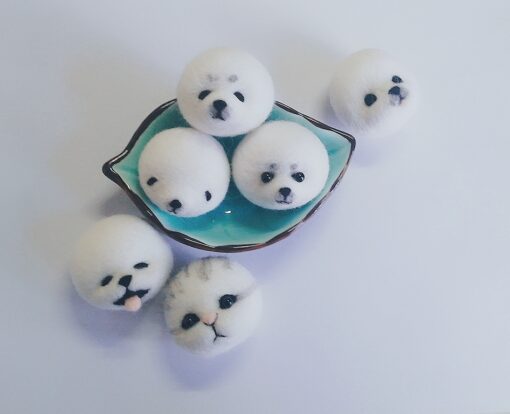
Where is `dish`? dish is located at coordinates (238, 231).